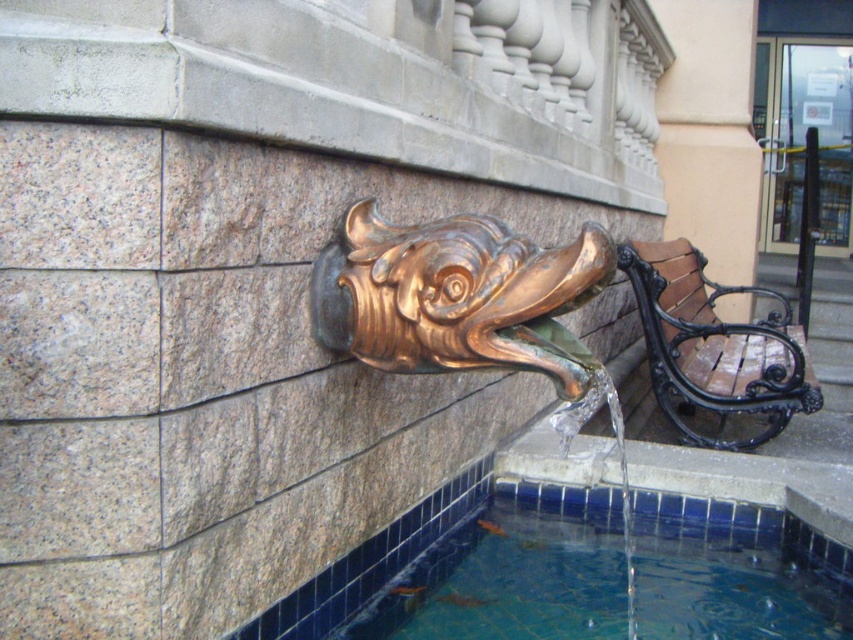
Question: Does shiny bronze fish at center appear on the left side of brown wooden bench at right?

Choices:
 (A) yes
 (B) no

Answer: (A)

Question: From the image, what is the correct spatial relationship of clear glass water at lower center in relation to brown wooden bench at right?

Choices:
 (A) left
 (B) right

Answer: (A)

Question: Estimate the real-world distances between objects in this image. Which object is farther from the brown wooden bench at right?

Choices:
 (A) shiny bronze fish at center
 (B) gold polished fish head at center

Answer: (A)

Question: Is gold polished fish head at center below shiny bronze fish at center?

Choices:
 (A) yes
 (B) no

Answer: (A)

Question: Considering the real-world distances, which object is closest to the brown wooden bench at right?

Choices:
 (A) shiny bronze fish at center
 (B) clear glass water at lower center
 (C) gold polished fish head at center

Answer: (C)

Question: Which of the following is the farthest from the observer?

Choices:
 (A) (784, 320)
 (B) (581, 541)
 (C) (350, 310)

Answer: (A)